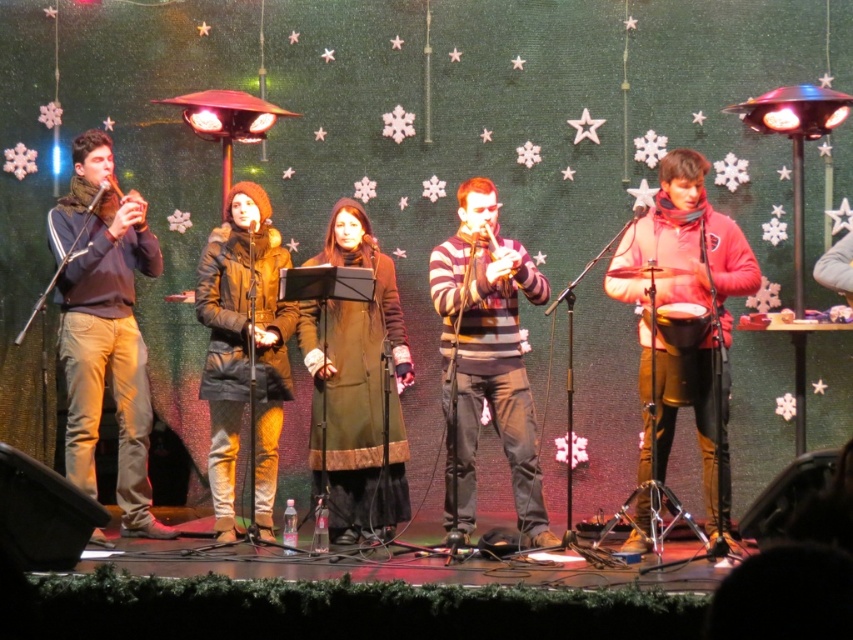
Does pink matte drum at right have a lesser width compared to matte wood flute at left?

In fact, pink matte drum at right might be wider than matte wood flute at left.

In the scene shown: Is pink matte drum at right wider than matte wood flute at left?

Correct, the width of pink matte drum at right exceeds that of matte wood flute at left.

Identify the location of pink matte drum at right. (693, 332).

Can you confirm if striped sweater at center is bigger than brown fuzzy coat at center?

No.

Is striped sweater at center taller than brown fuzzy coat at center?

No.

Locate an element on the screen. striped sweater at center is located at coordinates (488, 352).

The height and width of the screenshot is (640, 853). I want to click on striped sweater at center, so click(488, 352).

Can you confirm if dark brown leather coat at center is positioned above brown fuzzy coat at center?

Actually, dark brown leather coat at center is below brown fuzzy coat at center.

Does dark brown leather coat at center have a lesser height compared to brown fuzzy coat at center?

Correct, dark brown leather coat at center is not as tall as brown fuzzy coat at center.

The width and height of the screenshot is (853, 640). I want to click on dark brown leather coat at center, so click(358, 387).